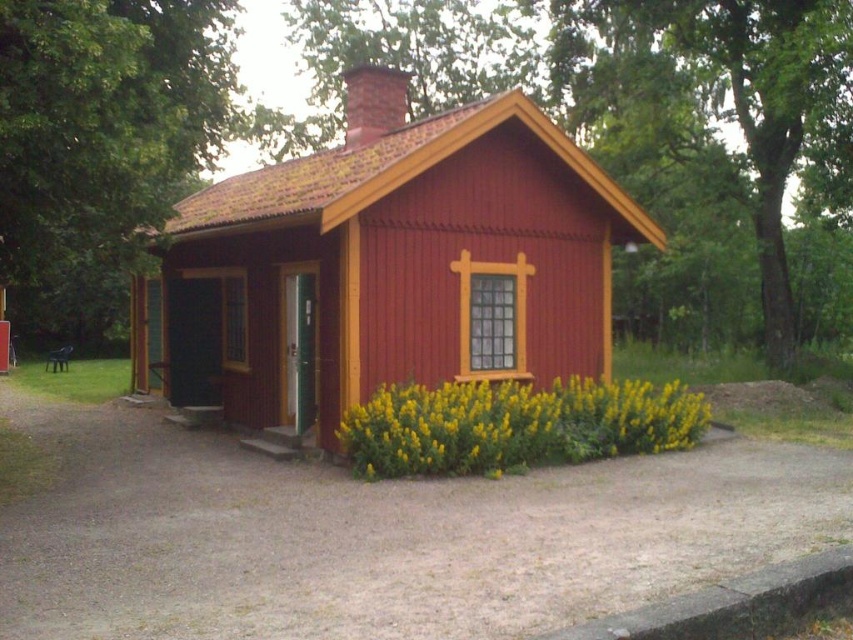
You are standing in front of the house and notice two points marked on the roof. The first point is located at coordinates point (479, 317) and the second at point (387, 426). Which of these points is closer to you?

Point (479, 317) is further to the camera than point (387, 426), so the point closer to you is point (387, 426).

You are standing in front of the house and notice the matte red wooden cabin at center and the yellow matte flowers at lower center. Which object is positioned to the left when viewed from your perspective?

The matte red wooden cabin at center is positioned to the left of the yellow matte flowers at lower center.